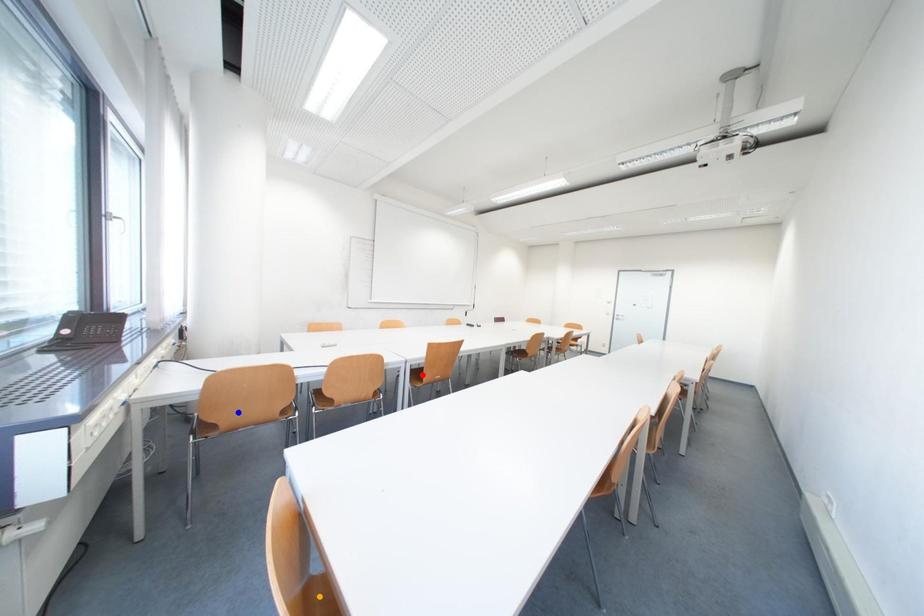
Order these from nearest to farthest:
A) red point
B) blue point
C) orange point

red point, blue point, orange point